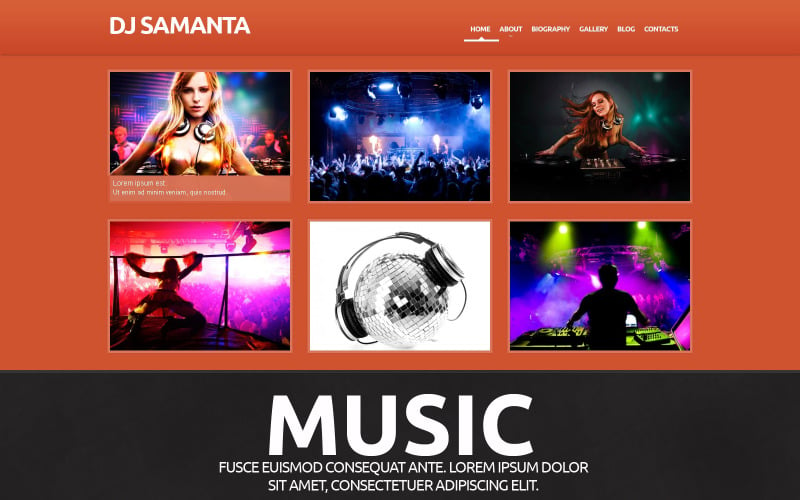
Identify the location of disco ball. (406, 295).